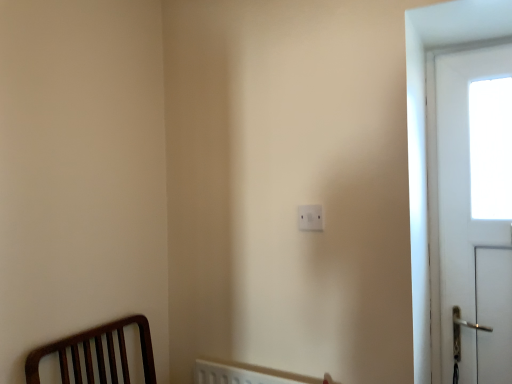
Question: From the image's perspective, is white glossy door at right positioned above or below white plastic light switch at center?

Choices:
 (A) above
 (B) below

Answer: (A)

Question: Which is correct: white glossy door at right is inside white plastic light switch at center, or outside of it?

Choices:
 (A) outside
 (B) inside

Answer: (A)

Question: From their relative heights in the image, would you say white glossy door at right is taller or shorter than white plastic light switch at center?

Choices:
 (A) short
 (B) tall

Answer: (B)

Question: Is white plastic light switch at center inside the boundaries of white glossy door at right, or outside?

Choices:
 (A) outside
 (B) inside

Answer: (A)

Question: From a real-world perspective, is white plastic light switch at center physically located above or below white glossy door at right?

Choices:
 (A) below
 (B) above

Answer: (B)

Question: In the image, is white plastic light switch at center positioned in front of or behind white glossy door at right?

Choices:
 (A) front
 (B) behind

Answer: (A)

Question: Based on their positions, is white plastic light switch at center located to the left or right of white glossy door at right?

Choices:
 (A) left
 (B) right

Answer: (A)